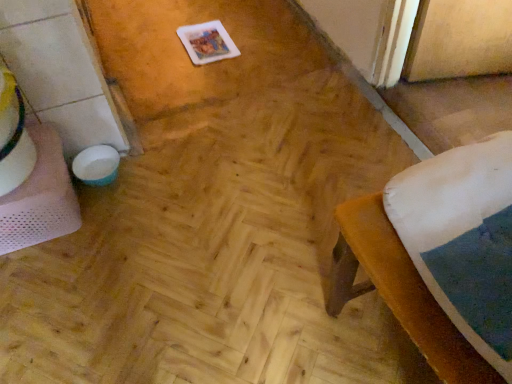
Where is `free space to the right of white mesh table at left`? free space to the right of white mesh table at left is located at coordinates (129, 216).